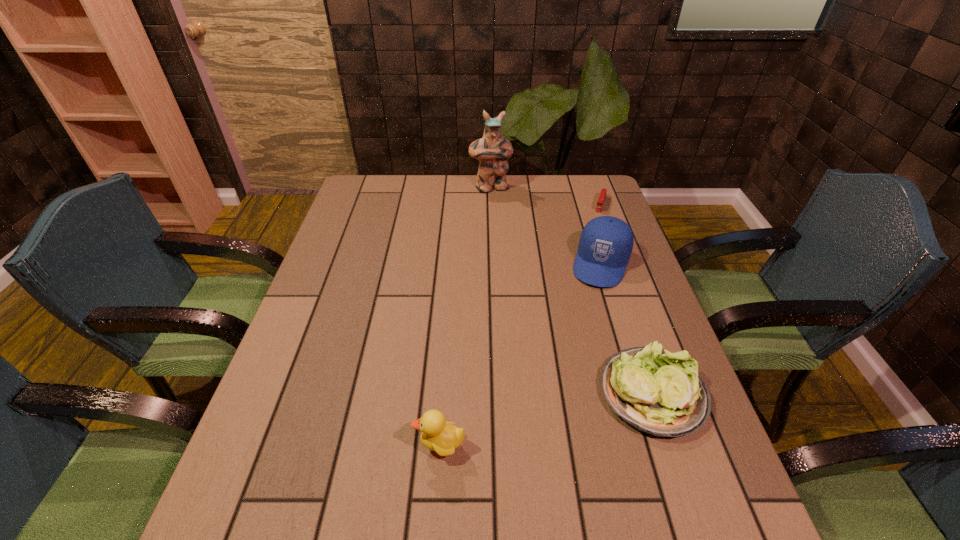
Locate an element on the screen. The height and width of the screenshot is (540, 960). free spot between the lettuce and the farthest object is located at coordinates (571, 291).

Where is `empty location between the stapler and the second shortest object`? empty location between the stapler and the second shortest object is located at coordinates (627, 299).

The image size is (960, 540). In order to click on vacant region between the third nearest object and the lettuce in this screenshot , I will do `click(627, 328)`.

The image size is (960, 540). I want to click on blank region between the lettuce and the third farthest object, so click(x=627, y=328).

Identify which object is located as the nearest to the duckling. Please provide its 2D coordinates. Your answer should be formatted as a tuple, i.e. [(x, y)], where the tuple contains the x and y coordinates of a point satisfying the conditions above.

[(657, 392)]

In order to click on object that is the fourth closest one to the stapler in this screenshot , I will do `click(443, 438)`.